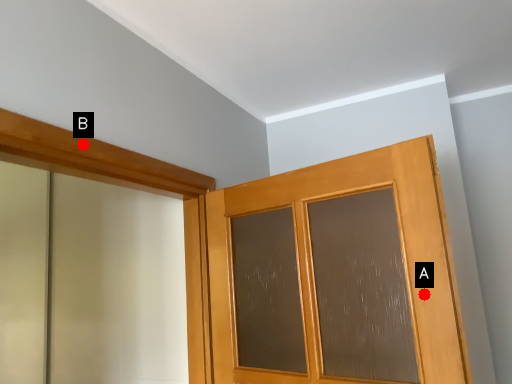
Question: Two points are circled on the image, labeled by A and B beside each circle. Which of the following is the closest to the observer?

Choices:
 (A) A is closer
 (B) B is closer

Answer: (A)